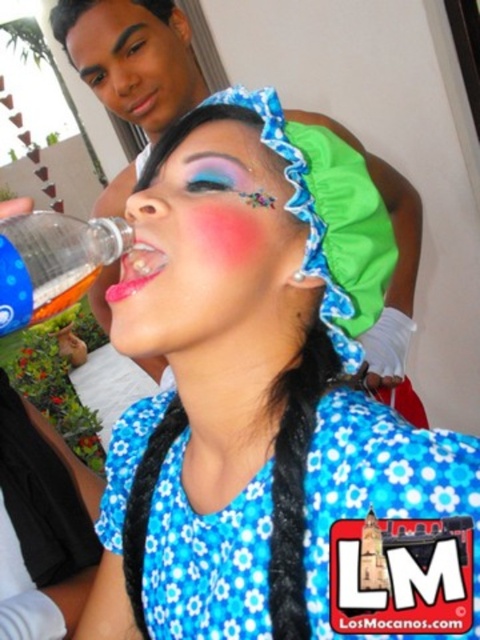
Question: Does matte plastic bottle at upper left have a greater width compared to smooth plastic bottle at upper left?

Choices:
 (A) yes
 (B) no

Answer: (B)

Question: Which of the following is the farthest from the observer?

Choices:
 (A) (123, 58)
 (B) (123, 481)
 (C) (342, 128)
 (D) (73, 273)

Answer: (C)

Question: Is smooth plastic bottle at upper left to the left of smooth skin face at upper left from the viewer's perspective?

Choices:
 (A) yes
 (B) no

Answer: (B)

Question: Which point is closer to the camera taking this photo?

Choices:
 (A) (96, 298)
 (B) (167, 250)

Answer: (B)

Question: Among these objects, which one is nearest to the camera?

Choices:
 (A) smooth skin face at upper left
 (B) translucent plastic bottle at left

Answer: (B)

Question: Is blue floral fabric dress at center smaller than smooth plastic bottle at upper left?

Choices:
 (A) yes
 (B) no

Answer: (A)